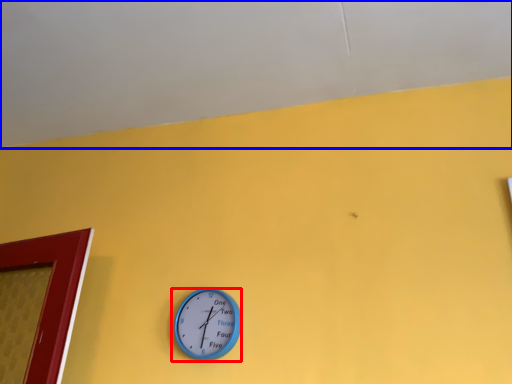
Question: Which object is further to the camera taking this photo, wall clock (highlighted by a red box) or backdrop (highlighted by a blue box)?

Choices:
 (A) wall clock
 (B) backdrop

Answer: (A)